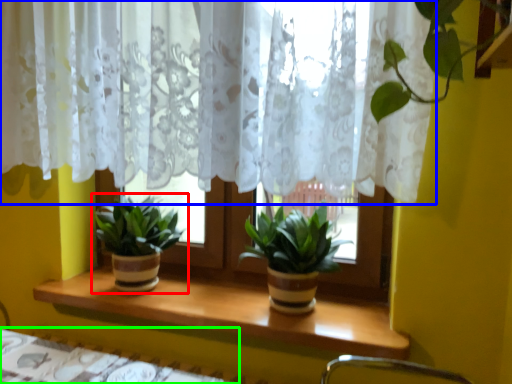
Question: Which is farther away from houseplant (highlighted by a red box)? curtain (highlighted by a blue box) or table (highlighted by a green box)?

Choices:
 (A) curtain
 (B) table

Answer: (A)